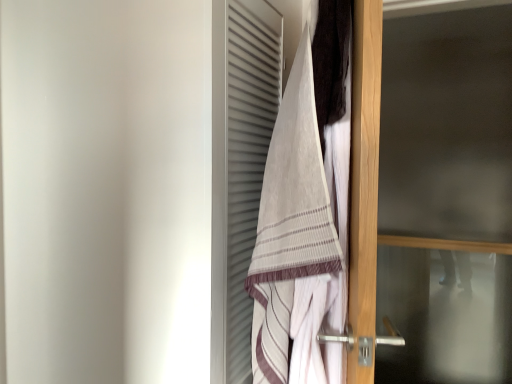
Question: Is dark brown towel at upper right closer to the viewer compared to striped cotton towel at center?

Choices:
 (A) yes
 (B) no

Answer: (A)

Question: Is dark brown towel at upper right to the left of striped cotton towel at center from the viewer's perspective?

Choices:
 (A) no
 (B) yes

Answer: (A)

Question: Does dark brown towel at upper right have a smaller size compared to striped cotton towel at center?

Choices:
 (A) yes
 (B) no

Answer: (A)

Question: Considering the relative sizes of dark brown towel at upper right and striped cotton towel at center in the image provided, is dark brown towel at upper right bigger than striped cotton towel at center?

Choices:
 (A) no
 (B) yes

Answer: (A)

Question: From a real-world perspective, is dark brown towel at upper right physically above striped cotton towel at center?

Choices:
 (A) yes
 (B) no

Answer: (A)

Question: In terms of size, does dark brown towel at upper right appear bigger or smaller than striped cotton towel at center?

Choices:
 (A) small
 (B) big

Answer: (A)

Question: In terms of height, does dark brown towel at upper right look taller or shorter compared to striped cotton towel at center?

Choices:
 (A) short
 (B) tall

Answer: (A)

Question: Considering the relative positions of dark brown towel at upper right and striped cotton towel at center in the image provided, is dark brown towel at upper right to the left or to the right of striped cotton towel at center?

Choices:
 (A) left
 (B) right

Answer: (B)

Question: Relative to striped cotton towel at center, is dark brown towel at upper right in front or behind?

Choices:
 (A) behind
 (B) front

Answer: (B)

Question: From their relative heights in the image, would you say striped cotton towel at center is taller or shorter than transparent glass screen door at right?

Choices:
 (A) tall
 (B) short

Answer: (B)

Question: Is striped cotton towel at center wider or thinner than transparent glass screen door at right?

Choices:
 (A) wide
 (B) thin

Answer: (A)

Question: Do you think striped cotton towel at center is within transparent glass screen door at right, or outside of it?

Choices:
 (A) inside
 (B) outside

Answer: (B)

Question: Does point (292, 375) appear closer or farther from the camera than point (452, 190)?

Choices:
 (A) closer
 (B) farther

Answer: (A)

Question: Considering the positions of dark brown towel at upper right and transparent glass screen door at right in the image, is dark brown towel at upper right bigger or smaller than transparent glass screen door at right?

Choices:
 (A) big
 (B) small

Answer: (B)

Question: Is dark brown towel at upper right situated inside transparent glass screen door at right or outside?

Choices:
 (A) outside
 (B) inside

Answer: (A)